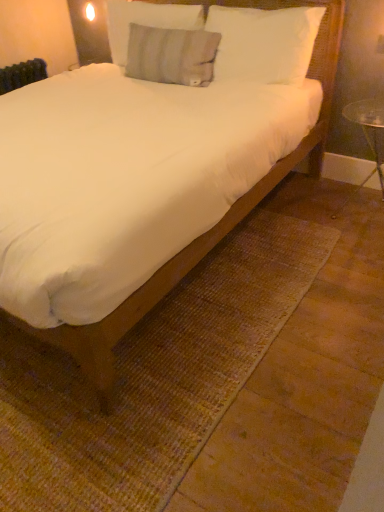
Find the location of a particular element. The image size is (384, 512). white soft pillow at upper center, positioned as the 1th pillow in right-to-left order is located at coordinates (264, 42).

The width and height of the screenshot is (384, 512). Identify the location of pillow above the gray cotton pillow at upper center, acting as the second pillow starting from the left (from the image's perspective). (146, 21).

Considering the relative sizes of gray cotton pillow at upper center, which appears as the second pillow when viewed from the right, and gray textured pillow at upper center, marked as the 3th pillow in a right-to-left arrangement, in the image provided, is gray cotton pillow at upper center, which appears as the second pillow when viewed from the right, taller than gray textured pillow at upper center, marked as the 3th pillow in a right-to-left arrangement,?

Correct, gray cotton pillow at upper center, which appears as the second pillow when viewed from the right, is much taller as gray textured pillow at upper center, marked as the 3th pillow in a right-to-left arrangement.

From the picture: Does gray cotton pillow at upper center, which appears as the second pillow when viewed from the right, appear on the left side of gray textured pillow at upper center, marked as the 3th pillow in a right-to-left arrangement?

No.

From a real-world perspective, between gray cotton pillow at upper center, acting as the second pillow starting from the left, and gray textured pillow at upper center, positioned as the 1th pillow in left-to-right order, who is vertically lower?

gray cotton pillow at upper center, acting as the second pillow starting from the left, is physically lower.

Which of these two, gray textured pillow at upper center, positioned as the 1th pillow in left-to-right order, or white soft pillow at upper center, positioned as the 1th pillow in right-to-left order, is thinner?

gray textured pillow at upper center, positioned as the 1th pillow in left-to-right order.

Based on the photo, in the image, is gray textured pillow at upper center, marked as the 3th pillow in a right-to-left arrangement, positioned in front of or behind white soft pillow at upper center, which ranks as the 3th pillow in left-to-right order?

In the image, gray textured pillow at upper center, marked as the 3th pillow in a right-to-left arrangement, appears behind white soft pillow at upper center, which ranks as the 3th pillow in left-to-right order.

Considering the relative sizes of gray textured pillow at upper center, positioned as the 1th pillow in left-to-right order, and white soft pillow at upper center, which ranks as the 3th pillow in left-to-right order, in the image provided, is gray textured pillow at upper center, positioned as the 1th pillow in left-to-right order, bigger than white soft pillow at upper center, which ranks as the 3th pillow in left-to-right order,?

Incorrect, gray textured pillow at upper center, positioned as the 1th pillow in left-to-right order, is not larger than white soft pillow at upper center, which ranks as the 3th pillow in left-to-right order.

At what (x,y) coordinates should I click in order to perform the action: click on pillow above the white soft pillow at upper center, positioned as the 1th pillow in right-to-left order (from a real-world perspective). Please return your answer as a coordinate pair (x, y). The width and height of the screenshot is (384, 512). Looking at the image, I should click on (146, 21).

Is white soft pillow at upper center, which ranks as the 3th pillow in left-to-right order, inside the boundaries of gray cotton pillow at upper center, acting as the second pillow starting from the left, or outside?

The correct answer is: outside.

Considering the sizes of objects white soft pillow at upper center, which ranks as the 3th pillow in left-to-right order, and gray cotton pillow at upper center, which appears as the second pillow when viewed from the right, in the image provided, who is thinner, white soft pillow at upper center, which ranks as the 3th pillow in left-to-right order, or gray cotton pillow at upper center, which appears as the second pillow when viewed from the right,?

gray cotton pillow at upper center, which appears as the second pillow when viewed from the right, is thinner.

From the image's perspective, is white soft pillow at upper center, positioned as the 1th pillow in right-to-left order, on gray cotton pillow at upper center, which appears as the second pillow when viewed from the right?

No.

Is white soft pillow at upper center, which ranks as the 3th pillow in left-to-right order, smaller than gray cotton pillow at upper center, acting as the second pillow starting from the left?

Actually, white soft pillow at upper center, which ranks as the 3th pillow in left-to-right order, might be larger than gray cotton pillow at upper center, acting as the second pillow starting from the left.

Is white soft bed at center closer to the viewer compared to gray textured pillow at upper center, marked as the 3th pillow in a right-to-left arrangement?

Yes, white soft bed at center is closer to the camera.

Choose the correct answer: Is white soft bed at center inside gray textured pillow at upper center, positioned as the 1th pillow in left-to-right order, or outside it?

white soft bed at center lies outside gray textured pillow at upper center, positioned as the 1th pillow in left-to-right order.

Considering the relative sizes of white soft bed at center and gray textured pillow at upper center, marked as the 3th pillow in a right-to-left arrangement, in the image provided, is white soft bed at center bigger than gray textured pillow at upper center, marked as the 3th pillow in a right-to-left arrangement,?

Indeed, white soft bed at center has a larger size compared to gray textured pillow at upper center, marked as the 3th pillow in a right-to-left arrangement.

Can you confirm if white soft bed at center is thinner than gray textured pillow at upper center, marked as the 3th pillow in a right-to-left arrangement?

Incorrect, the width of white soft bed at center is not less than that of gray textured pillow at upper center, marked as the 3th pillow in a right-to-left arrangement.

Is white soft bed at center bigger than gray cotton pillow at upper center, acting as the second pillow starting from the left?

Indeed, white soft bed at center has a larger size compared to gray cotton pillow at upper center, acting as the second pillow starting from the left.

From the image's perspective, would you say white soft bed at center is shown under gray cotton pillow at upper center, which appears as the second pillow when viewed from the right?

Yes.

At what (x,y) coordinates should I click in order to perform the action: click on bed below the gray cotton pillow at upper center, acting as the second pillow starting from the left (from a real-world perspective). Please return your answer as a coordinate pair (x, y). The height and width of the screenshot is (512, 384). Looking at the image, I should click on (212, 228).

Can you tell me how much white soft bed at center and gray cotton pillow at upper center, which appears as the second pillow when viewed from the right, differ in facing direction?

5.87 degrees.

From the image's perspective, which object appears higher, white soft bed at center or white soft pillow at upper center, positioned as the 1th pillow in right-to-left order?

white soft pillow at upper center, positioned as the 1th pillow in right-to-left order.

How different are the orientations of white soft bed at center and white soft pillow at upper center, positioned as the 1th pillow in right-to-left order, in degrees?

white soft bed at center and white soft pillow at upper center, positioned as the 1th pillow in right-to-left order, are facing 0.279 degrees away from each other.

From the white soft bed at center, count 3rd pillow to the right and point to it. Please provide its 2D coordinates.

[(264, 42)]

Is white soft bed at center directly adjacent to white soft pillow at upper center, which ranks as the 3th pillow in left-to-right order?

No, white soft bed at center is not beside white soft pillow at upper center, which ranks as the 3th pillow in left-to-right order.

Looking at this image, is gray textured pillow at upper center, marked as the 3th pillow in a right-to-left arrangement, not near gray cotton pillow at upper center, acting as the second pillow starting from the left?

gray textured pillow at upper center, marked as the 3th pillow in a right-to-left arrangement, is near gray cotton pillow at upper center, acting as the second pillow starting from the left, not far away.

Is gray cotton pillow at upper center, which appears as the second pillow when viewed from the right, inside gray textured pillow at upper center, marked as the 3th pillow in a right-to-left arrangement?

No, gray cotton pillow at upper center, which appears as the second pillow when viewed from the right, is located outside of gray textured pillow at upper center, marked as the 3th pillow in a right-to-left arrangement.

How different are the orientations of gray textured pillow at upper center, positioned as the 1th pillow in left-to-right order, and gray cotton pillow at upper center, acting as the second pillow starting from the left, in degrees?

2.44 degrees separate the facing orientations of gray textured pillow at upper center, positioned as the 1th pillow in left-to-right order, and gray cotton pillow at upper center, acting as the second pillow starting from the left.

I want to click on the 1st pillow to the right of the gray textured pillow at upper center, positioned as the 1th pillow in left-to-right order, starting your count from the anchor, so click(171, 55).

The height and width of the screenshot is (512, 384). What are the coordinates of `the 2nd pillow in front of the gray textured pillow at upper center, positioned as the 1th pillow in left-to-right order` in the screenshot? It's located at (264, 42).

When comparing their distances from gray textured pillow at upper center, marked as the 3th pillow in a right-to-left arrangement, does white soft bed at center or gray cotton pillow at upper center, which appears as the second pillow when viewed from the right, seem closer?

gray cotton pillow at upper center, which appears as the second pillow when viewed from the right, is positioned closer to the anchor gray textured pillow at upper center, marked as the 3th pillow in a right-to-left arrangement.

Based on their spatial positions, is gray cotton pillow at upper center, acting as the second pillow starting from the left, or gray textured pillow at upper center, positioned as the 1th pillow in left-to-right order, closer to white soft pillow at upper center, which ranks as the 3th pillow in left-to-right order?

Result: Based on the image, gray cotton pillow at upper center, acting as the second pillow starting from the left, appears to be nearer to white soft pillow at upper center, which ranks as the 3th pillow in left-to-right order.

From the picture: Which object lies nearer to the anchor point white soft pillow at upper center, which ranks as the 3th pillow in left-to-right order, white soft bed at center or gray textured pillow at upper center, marked as the 3th pillow in a right-to-left arrangement?

white soft bed at center is positioned closer to the anchor white soft pillow at upper center, which ranks as the 3th pillow in left-to-right order.

From the image, which object appears to be farther from white soft bed at center, gray cotton pillow at upper center, which appears as the second pillow when viewed from the right, or white soft pillow at upper center, positioned as the 1th pillow in right-to-left order?

The object further to white soft bed at center is gray cotton pillow at upper center, which appears as the second pillow when viewed from the right.

Considering their positions, is gray textured pillow at upper center, positioned as the 1th pillow in left-to-right order, positioned closer to gray cotton pillow at upper center, which appears as the second pillow when viewed from the right, than white soft bed at center?

The object closer to gray cotton pillow at upper center, which appears as the second pillow when viewed from the right, is gray textured pillow at upper center, positioned as the 1th pillow in left-to-right order.

Considering their positions, is gray cotton pillow at upper center, which appears as the second pillow when viewed from the right, positioned closer to gray textured pillow at upper center, positioned as the 1th pillow in left-to-right order, than white soft bed at center?

gray cotton pillow at upper center, which appears as the second pillow when viewed from the right, lies closer to gray textured pillow at upper center, positioned as the 1th pillow in left-to-right order, than the other object.

Looking at this image, based on their spatial positions, is gray textured pillow at upper center, marked as the 3th pillow in a right-to-left arrangement, or gray cotton pillow at upper center, which appears as the second pillow when viewed from the right, closer to white soft pillow at upper center, which ranks as the 3th pillow in left-to-right order?

Among the two, gray cotton pillow at upper center, which appears as the second pillow when viewed from the right, is located nearer to white soft pillow at upper center, which ranks as the 3th pillow in left-to-right order.

Looking at this image, considering their positions, is gray cotton pillow at upper center, which appears as the second pillow when viewed from the right, positioned closer to white soft pillow at upper center, positioned as the 1th pillow in right-to-left order, than white soft bed at center?

gray cotton pillow at upper center, which appears as the second pillow when viewed from the right, lies closer to white soft pillow at upper center, positioned as the 1th pillow in right-to-left order, than the other object.

Identify the location of pillow situated between gray textured pillow at upper center, marked as the 3th pillow in a right-to-left arrangement, and white soft pillow at upper center, positioned as the 1th pillow in right-to-left order, from left to right. Image resolution: width=384 pixels, height=512 pixels. (171, 55).

Locate an element on the screen. Image resolution: width=384 pixels, height=512 pixels. pillow between white soft bed at center and gray cotton pillow at upper center, acting as the second pillow starting from the left, along the z-axis is located at coordinates (264, 42).